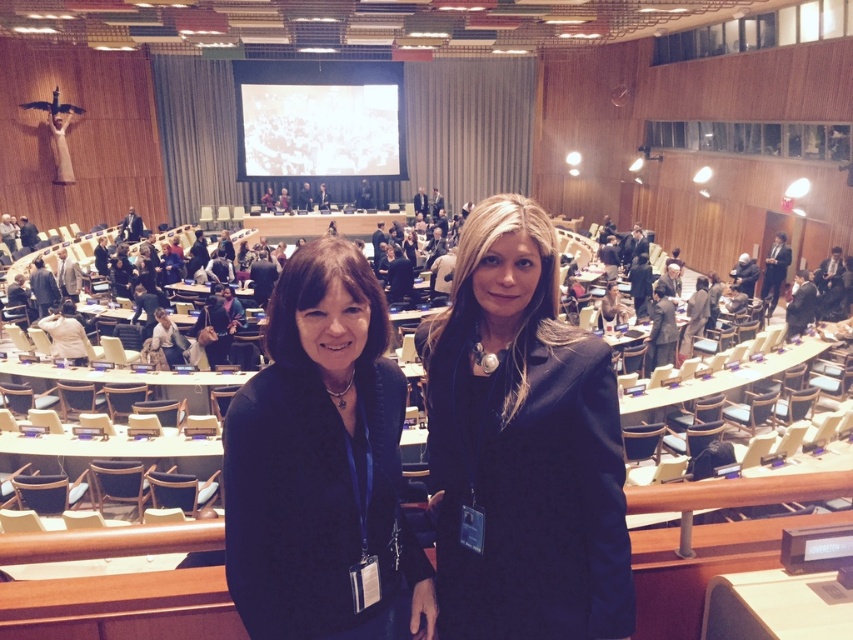
Is point (548, 310) closer to camera compared to point (383, 536)?

No, it is behind (383, 536).

This screenshot has height=640, width=853. I want to click on black wool coat at center, so pos(521,445).